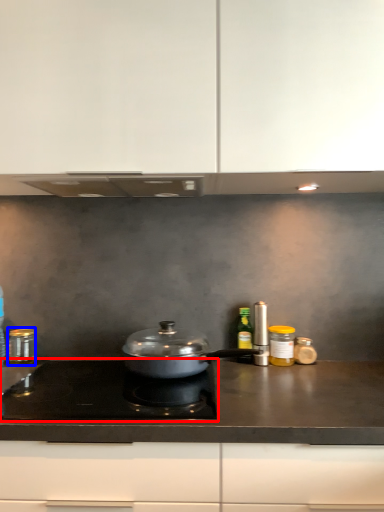
Question: Which object is closer to the camera taking this photo, gas stove (highlighted by a red box) or kitchen appliance (highlighted by a blue box)?

Choices:
 (A) gas stove
 (B) kitchen appliance

Answer: (A)